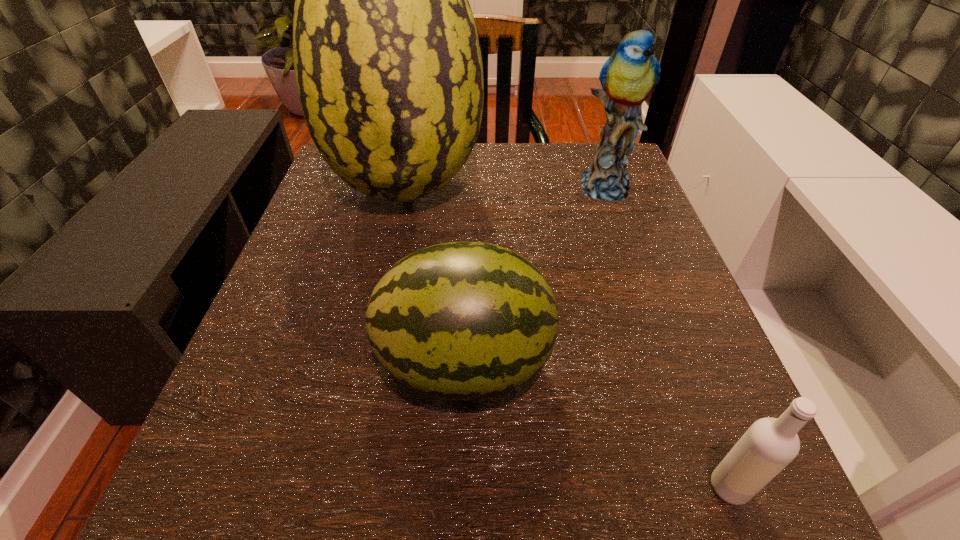
The image size is (960, 540). I want to click on the farther watermelon, so click(388, 66).

Locate an element on the screen. This screenshot has height=540, width=960. the taller watermelon is located at coordinates (388, 66).

What are the coordinates of `the third shortest object` in the screenshot? It's located at (628, 77).

This screenshot has height=540, width=960. What are the coordinates of `the second nearest object` in the screenshot? It's located at (460, 320).

Identify the location of the shorter watermelon. Image resolution: width=960 pixels, height=540 pixels. (460, 320).

Where is `the nearest object`? The image size is (960, 540). the nearest object is located at coordinates (770, 444).

Find the location of a particular element. free point located 0.270m on the front of the taller watermelon is located at coordinates (373, 355).

This screenshot has width=960, height=540. Identify the location of blank area located on the face of the parrot. (628, 249).

The image size is (960, 540). Identify the location of free space located at the stem end of the shorter watermelon. (658, 363).

Locate an element on the screen. The image size is (960, 540). vacant area situated 0.350m on the left of the nearest object is located at coordinates (418, 487).